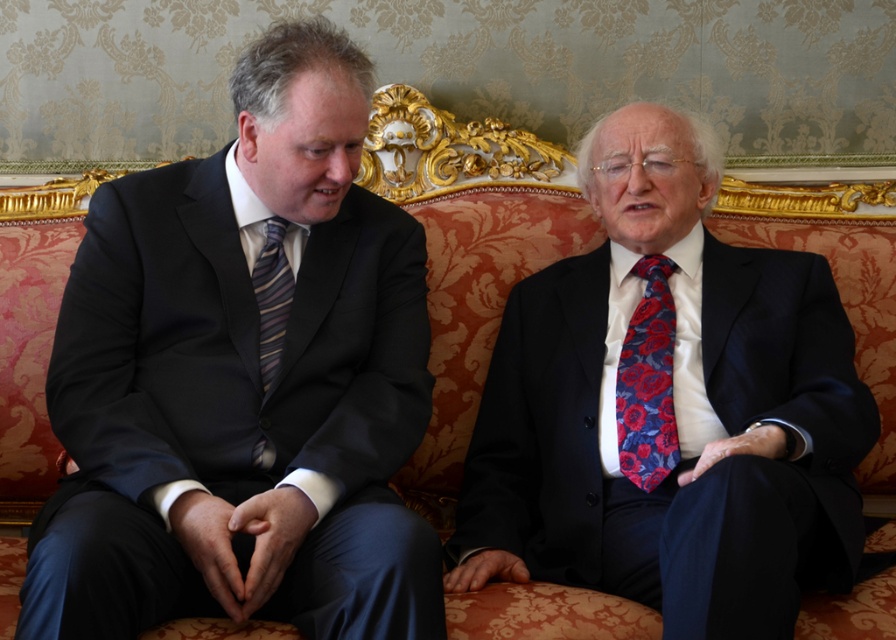
Question: Can you confirm if matte black suit at left is thinner than matte black suit at center?

Choices:
 (A) yes
 (B) no

Answer: (A)

Question: Which point is closer to the camera?

Choices:
 (A) matte black suit at center
 (B) striped silk tie at left
 (C) matte black suit at left
 (D) red floral silk tie at right

Answer: (C)

Question: Is the position of matte black suit at left less distant than that of red floral silk tie at right?

Choices:
 (A) yes
 (B) no

Answer: (A)

Question: Based on their relative distances, which object is farther from the red floral silk tie at right?

Choices:
 (A) striped silk tie at left
 (B) matte black suit at left
 (C) matte black suit at center

Answer: (A)

Question: Which object is closer to the camera taking this photo?

Choices:
 (A) matte black suit at left
 (B) red floral silk tie at right
 (C) striped silk tie at left

Answer: (A)

Question: Is matte black suit at left to the left of striped silk tie at left from the viewer's perspective?

Choices:
 (A) no
 (B) yes

Answer: (A)